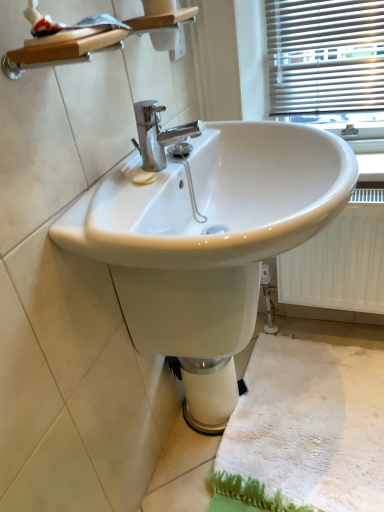
Question: From a real-world perspective, is white glossy sink at center positioned over white textured radiator at lower right based on gravity?

Choices:
 (A) no
 (B) yes

Answer: (B)

Question: From the image's perspective, is white glossy sink at center beneath white textured radiator at lower right?

Choices:
 (A) yes
 (B) no

Answer: (B)

Question: Could you tell me if white glossy sink at center is turned towards white textured radiator at lower right?

Choices:
 (A) no
 (B) yes

Answer: (A)

Question: Considering the relative sizes of white glossy sink at center and white textured radiator at lower right in the image provided, is white glossy sink at center smaller than white textured radiator at lower right?

Choices:
 (A) no
 (B) yes

Answer: (A)

Question: Is white glossy sink at center closer to the viewer compared to white textured radiator at lower right?

Choices:
 (A) no
 (B) yes

Answer: (B)

Question: Can you confirm if white glossy sink at center is bigger than white textured radiator at lower right?

Choices:
 (A) yes
 (B) no

Answer: (A)

Question: Does white fluffy bath mat at lower right come behind white glossy sink at center?

Choices:
 (A) no
 (B) yes

Answer: (B)

Question: Does white fluffy bath mat at lower right have a greater width compared to white glossy sink at center?

Choices:
 (A) yes
 (B) no

Answer: (A)

Question: Is white fluffy bath mat at lower right located outside white glossy sink at center?

Choices:
 (A) no
 (B) yes

Answer: (B)

Question: Is white fluffy bath mat at lower right next to white glossy sink at center and touching it?

Choices:
 (A) yes
 (B) no

Answer: (B)

Question: Does white fluffy bath mat at lower right have a lesser height compared to white glossy sink at center?

Choices:
 (A) yes
 (B) no

Answer: (A)

Question: Is white fluffy bath mat at lower right to the right of white glossy sink at center from the viewer's perspective?

Choices:
 (A) yes
 (B) no

Answer: (A)

Question: Is white glossy sink at center at the left side of white fluffy bath mat at lower right?

Choices:
 (A) yes
 (B) no

Answer: (A)